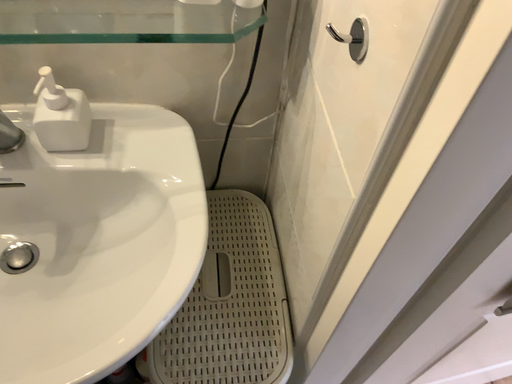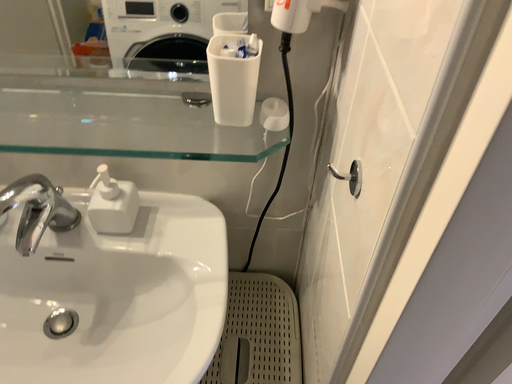
Question: How did the camera likely rotate when shooting the video?

Choices:
 (A) rotated right
 (B) rotated left

Answer: (B)